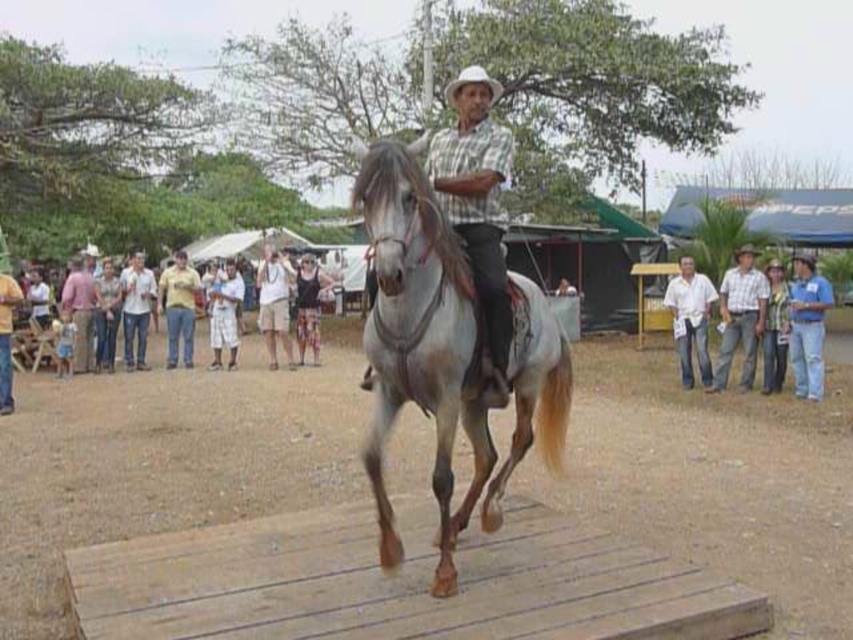
Question: Among these objects, which one is farthest from the camera?

Choices:
 (A) plaid shirt at right
 (B) black tank top at center
 (C) blue jeans at right

Answer: (B)

Question: Based on their relative distances, which object is nearer to the plaid shirt at right?

Choices:
 (A) light brown cotton pants at center
 (B) white glossy horse at center

Answer: (B)

Question: Does checkered fabric shirt at center come in front of white cotton shirt at right?

Choices:
 (A) no
 (B) yes

Answer: (B)

Question: Does brown wooden dirt track at center appear on the right side of white glossy horse at center?

Choices:
 (A) no
 (B) yes

Answer: (A)

Question: Is light brown cotton pants at center positioned behind black tank top at center?

Choices:
 (A) no
 (B) yes

Answer: (B)

Question: Which object is positioned farthest from the plaid shirt at right?

Choices:
 (A) black tank top at center
 (B) light brown cotton pants at center
 (C) blue jeans at right
 (D) white glossy horse at center

Answer: (B)